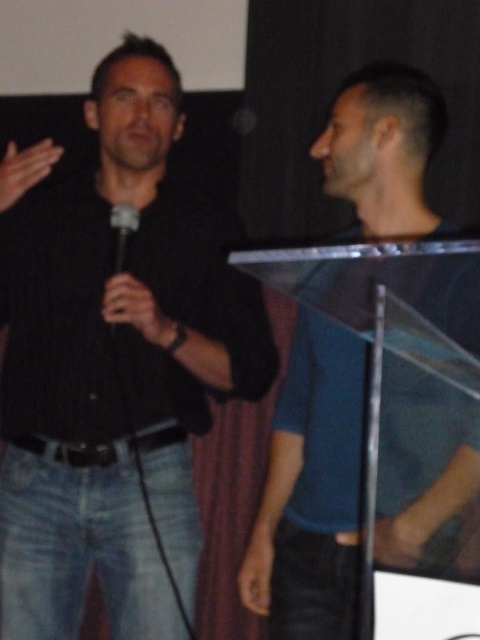
You are a photographer setting up for an event. You need to ensure that the black matte shirt at left and the black plastic microphone at center are both visible in your photo. Based on their positions, which object should you prioritize framing closer to the bottom of the image?

The black matte shirt at left should be framed closer to the bottom of the image because it is located below the black plastic microphone at center according to the description.

You are standing in the room where the two people are. You want to take a photo of the point at coordinates point [104,253]. If your camera can focus on objects within 5 feet, will it be able to capture the point clearly?

The distance of point [104,253] from camera is 5.03 feet, so the camera cannot focus on it since it is slightly beyond the 5 feet range.